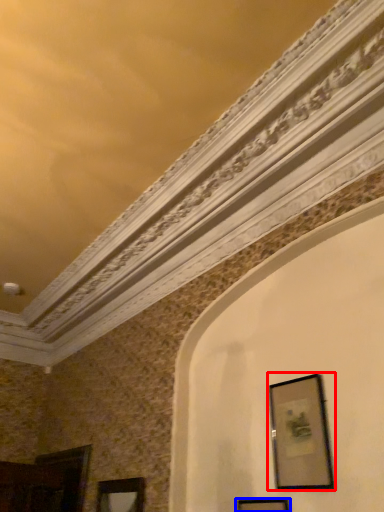
Question: Which of the following is the farthest to the observer, picture frame (highlighted by a red box) or picture frame (highlighted by a blue box)?

Choices:
 (A) picture frame
 (B) picture frame

Answer: (A)